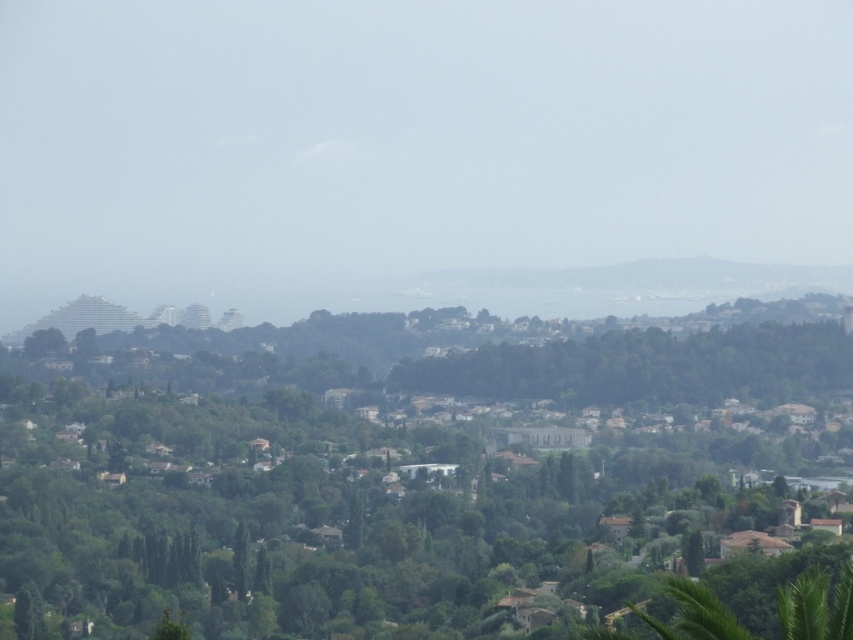
From the picture: You are standing at the highest point of the hill and looking down at the landscape. Which direction should you look to find the transparent glass skyscraper at center?

The transparent glass skyscraper at center is located at coordinates point (408, 145), so you should look towards the lower left direction from your current position at the highest point of the hill.

Based on the photo, you are a drone operator tasked with flying a drone between the transparent glass skyscraper at center and the green leafy tree at center. The drone has a maximum flight range of 60 meters. Can the drone safely travel between these two points without exceeding its range?

The transparent glass skyscraper at center and green leafy tree at center are 56.09 meters apart from each other. Since the drone has a maximum flight range of 60 meters, it can safely travel between these two points without exceeding its range.

You are an architect designing a new park in this area. You need to decide whether the transparent glass skyscraper at center will block the view of the green leafy tree at center from your proposed park location. Based on their sizes, can you determine which one is larger?

The transparent glass skyscraper at center is bigger than the green leafy tree at center, so the skyscraper will block the view of the tree.